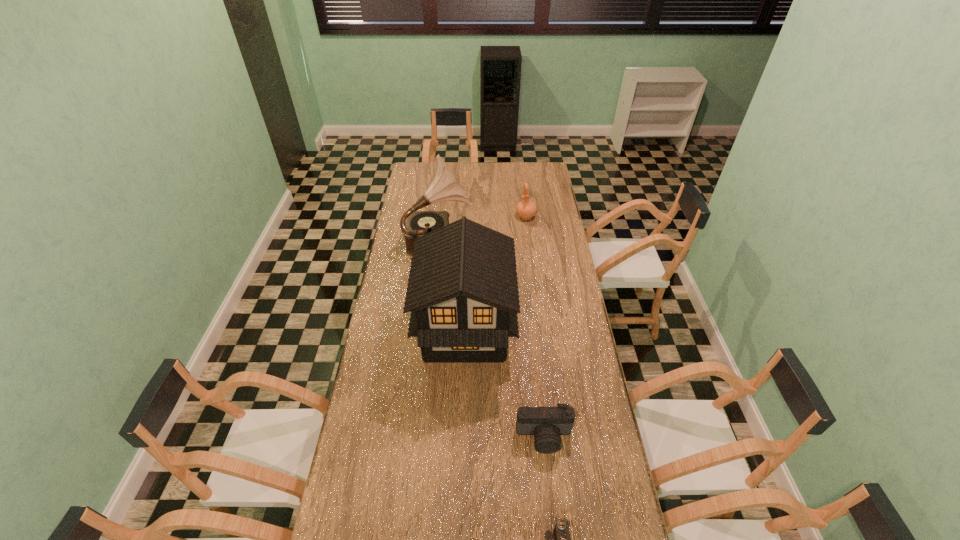
This screenshot has height=540, width=960. I want to click on record player, so click(443, 187).

Locate an element on the screen. dollhouse is located at coordinates (462, 293).

Identify the location of the third shortest object. This screenshot has width=960, height=540. coord(526,209).

Image resolution: width=960 pixels, height=540 pixels. In order to click on the farther camera in this screenshot , I will do `click(546, 424)`.

Where is `the taller camera`? This screenshot has width=960, height=540. the taller camera is located at coordinates [546, 424].

This screenshot has width=960, height=540. What are the coordinates of `free point located from the horn of the record player` in the screenshot? It's located at (507, 238).

You are a GUI agent. You are given a task and a screenshot of the screen. Output one action in this format:
    pyautogui.click(x=<x>, y=<y>)
    Task: Click on the vacant position located 0.280m on the front-facing side of the third farthest object
    
    Given the screenshot: What is the action you would take?
    pyautogui.click(x=581, y=330)

This screenshot has height=540, width=960. What are the coordinates of `free spot located on the spout of the third tallest object` in the screenshot? It's located at (529, 245).

The width and height of the screenshot is (960, 540). I want to click on vacant space located 0.100m at the lens of the taller camera, so click(x=549, y=484).

The image size is (960, 540). Find the location of `object situated at the left edge`. object situated at the left edge is located at coordinates click(443, 187).